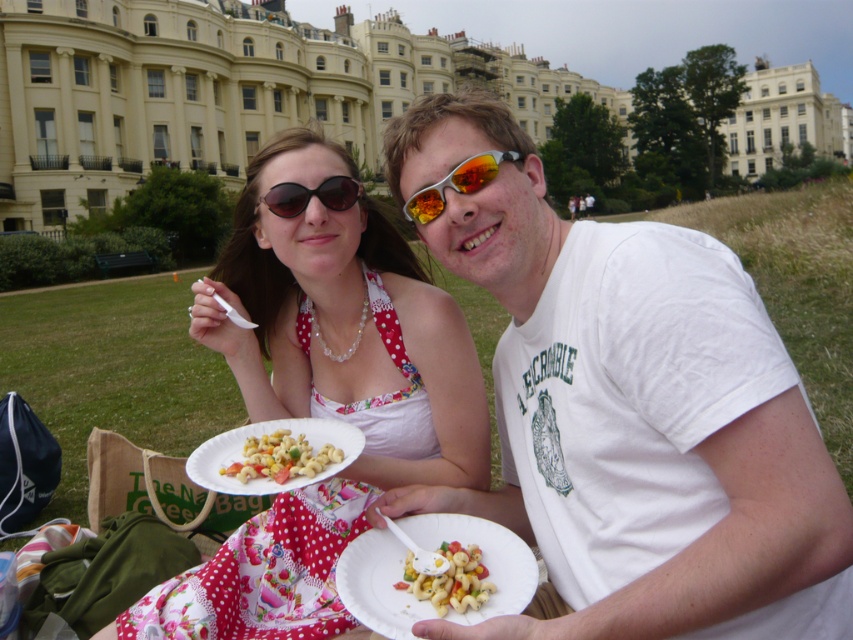
Can you confirm if matte floral dress at center is smaller than white glossy pasta salad at center?

Incorrect, matte floral dress at center is not smaller in size than white glossy pasta salad at center.

Is point (407, 320) in front of point (231, 461)?

No, (407, 320) is further to viewer.

You are a GUI agent. You are given a task and a screenshot of the screen. Output one action in this format:
    pyautogui.click(x=<x>, y=<y>)
    Task: Click on the matte floral dress at center
    The image size is (853, 640).
    Given the screenshot: What is the action you would take?
    pyautogui.click(x=322, y=396)

Does matte floral dress at center have a smaller size compared to black plastic sunglasses at upper center?

Incorrect, matte floral dress at center is not smaller in size than black plastic sunglasses at upper center.

Which is behind, point (260, 192) or point (312, 193)?

Point (260, 192)

The width and height of the screenshot is (853, 640). In order to click on matte floral dress at center in this screenshot , I will do coord(322,396).

Does white matte t-shirt at center come behind matte floral dress at center?

No.

Between white matte t-shirt at center and matte floral dress at center, which one appears on the left side from the viewer's perspective?

matte floral dress at center

Describe the element at coordinates (630, 412) in the screenshot. The image size is (853, 640). I see `white matte t-shirt at center` at that location.

Where is `white matte t-shirt at center`? white matte t-shirt at center is located at coordinates (630, 412).